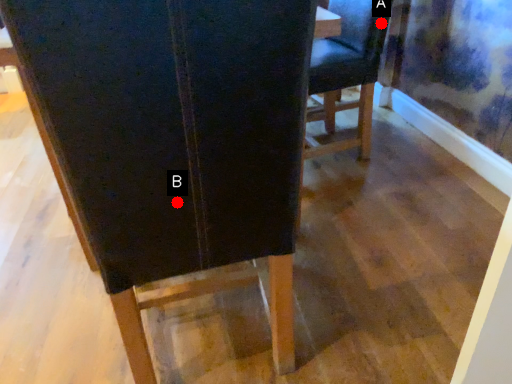
Question: Two points are circled on the image, labeled by A and B beside each circle. Which point is closer to the camera taking this photo?

Choices:
 (A) A is closer
 (B) B is closer

Answer: (B)